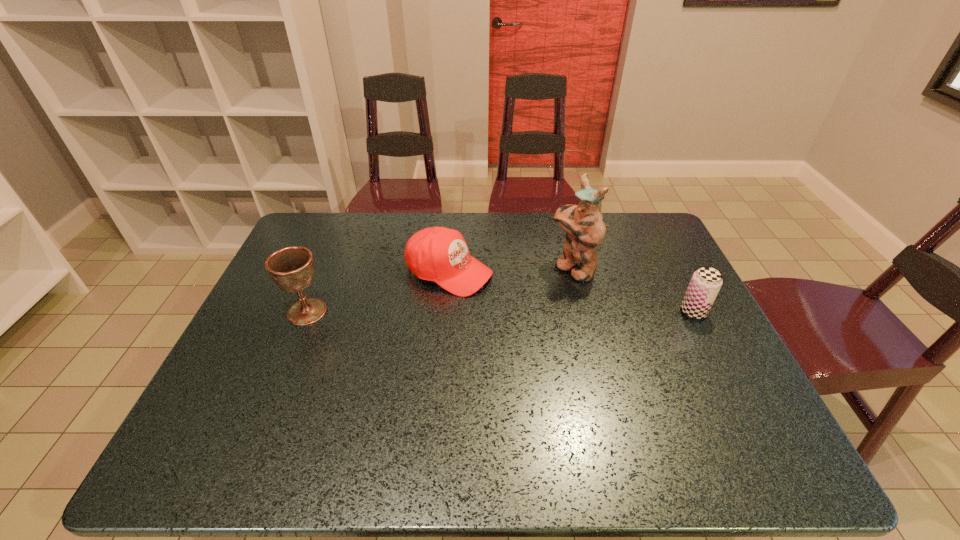
The height and width of the screenshot is (540, 960). I want to click on the leftmost object, so click(291, 268).

You are a GUI agent. You are given a task and a screenshot of the screen. Output one action in this format:
    pyautogui.click(x=<x>, y=<y>)
    Task: Click on the third shortest object
    
    Given the screenshot: What is the action you would take?
    pyautogui.click(x=291, y=268)

Where is `beer can`? The width and height of the screenshot is (960, 540). beer can is located at coordinates (706, 282).

The width and height of the screenshot is (960, 540). What are the coordinates of `figurine` in the screenshot? It's located at (585, 227).

Where is `the second object from right to left`? the second object from right to left is located at coordinates (585, 227).

You are a GUI agent. You are given a task and a screenshot of the screen. Output one action in this format:
    pyautogui.click(x=<x>, y=<y>)
    Task: Click on the second object from left to right
    
    Given the screenshot: What is the action you would take?
    pyautogui.click(x=439, y=254)

The width and height of the screenshot is (960, 540). Identify the location of blank space located on the back of the second tallest object. (341, 231).

Identify the location of vacant space situated 0.070m on the back of the beer can. (681, 286).

Identify the location of free location located 0.210m on the front-facing side of the tallest object. The width and height of the screenshot is (960, 540). (502, 310).

Image resolution: width=960 pixels, height=540 pixels. I want to click on vacant space situated 0.280m on the front-facing side of the tallest object, so click(483, 321).